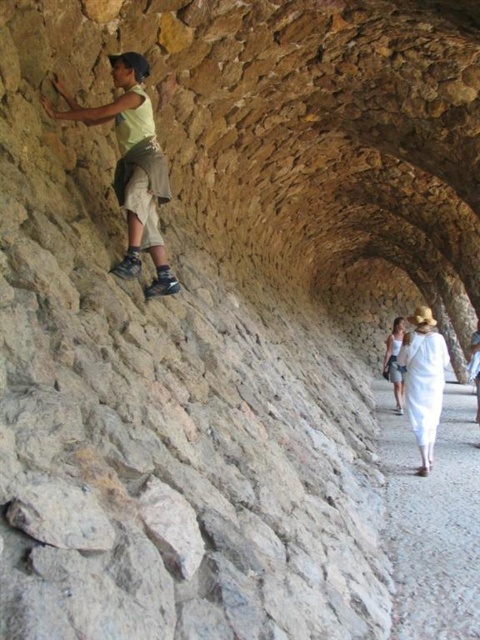
Consider the image. You are navigating through a stone tunnel and see a matte yellow shirt at upper left and a white cotton hat at right. Which object is closer to you?

The matte yellow shirt at upper left is closer to you because it is in front of the white cotton hat at right.

You are standing at the entrance of the stone tunnel and see a smooth gravel path at lower right and a white cotton hat at right. Which object is positioned lower in the scene?

The smooth gravel path at lower right is positioned lower than the white cotton hat at right.

You are standing inside the stone tunnel and see two points marked on the wall. The first point is at coordinate point (167, 168) and the second is at point (441, 378). Which point is closer to you?

Point (167, 168) is closer to the camera than point (441, 378).